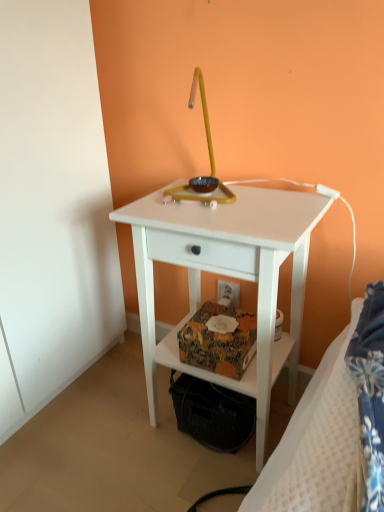
Question: Is white matte nightstand at center in front of or behind white plastic electric outlet at lower center in the image?

Choices:
 (A) front
 (B) behind

Answer: (A)

Question: Is white matte nightstand at center situated inside white plastic electric outlet at lower center or outside?

Choices:
 (A) outside
 (B) inside

Answer: (A)

Question: Which of these objects is positioned farthest from the white plastic electric outlet at lower center?

Choices:
 (A) white textured bed at lower right
 (B) white matte nightstand at center

Answer: (A)

Question: Which is farther from the white textured bed at lower right?

Choices:
 (A) white matte nightstand at center
 (B) white plastic electric outlet at lower center

Answer: (B)